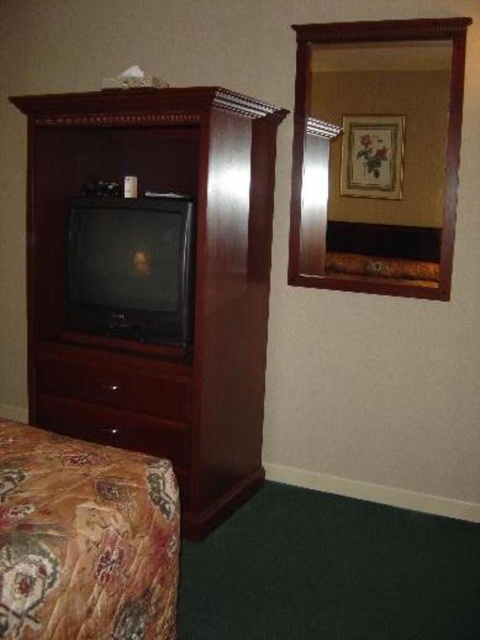
Question: Does mahogany wood dresser at left appear on the right side of floral-patterned fabric bed at lower left?

Choices:
 (A) no
 (B) yes

Answer: (A)

Question: Which of the following is the farthest from the observer?

Choices:
 (A) (36, 184)
 (B) (172, 563)

Answer: (A)

Question: Is mahogany wood dresser at left below floral-patterned fabric bed at lower left?

Choices:
 (A) no
 (B) yes

Answer: (A)

Question: Which object is closer to the camera taking this photo?

Choices:
 (A) floral-patterned fabric bed at lower left
 (B) mahogany wood dresser at left

Answer: (A)

Question: Is mahogany wood dresser at left above floral-patterned fabric bed at lower left?

Choices:
 (A) yes
 (B) no

Answer: (A)